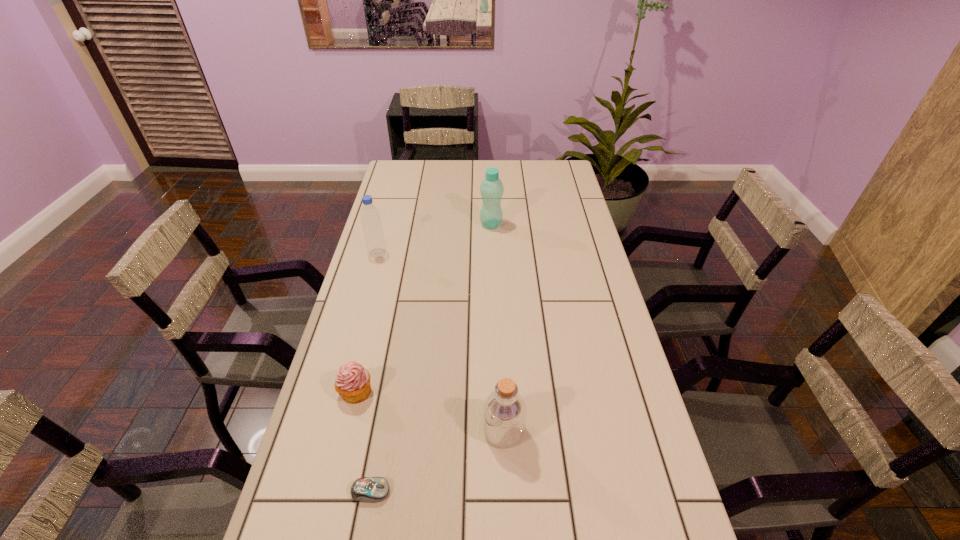
Locate an element on the screen. This screenshot has height=540, width=960. vacant space located on the back of the farthest object is located at coordinates (491, 208).

The image size is (960, 540). I want to click on vacant position located on the left of the nearest bottle, so click(x=327, y=431).

This screenshot has height=540, width=960. In order to click on free space located 0.210m on the back of the second shortest object in this screenshot , I will do `click(373, 318)`.

This screenshot has width=960, height=540. Find the location of `vacant area situated on the wheel side of the computer mouse`. vacant area situated on the wheel side of the computer mouse is located at coordinates (441, 491).

Identify the location of bottle present at the left edge. This screenshot has width=960, height=540. (370, 217).

At what (x,y) coordinates should I click in order to perform the action: click on cupcake positioned at the left edge. Please return your answer as a coordinate pair (x, y). This screenshot has width=960, height=540. Looking at the image, I should click on (352, 383).

Locate an element on the screen. computer mouse positioned at the left edge is located at coordinates (365, 489).

In the image, there is a desktop. Where is `vacant space at the left edge`? vacant space at the left edge is located at coordinates (360, 280).

Image resolution: width=960 pixels, height=540 pixels. In order to click on free space at the right edge of the desktop in this screenshot , I will do `click(585, 255)`.

Find the location of `vacant space that is in between the cupcake and the nearest bottle`. vacant space that is in between the cupcake and the nearest bottle is located at coordinates (430, 411).